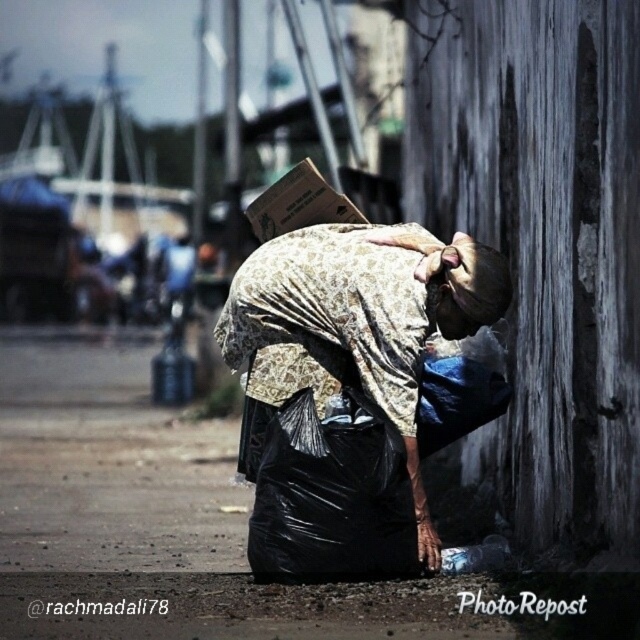
Question: Is printed fabric bag at lower center to the left of brown woven hat at center from the viewer's perspective?

Choices:
 (A) yes
 (B) no

Answer: (A)

Question: Estimate the real-world distances between objects in this image. Which object is closer to the brown woven hat at center?

Choices:
 (A) printed fabric bag at lower center
 (B) brown cardboard box at center

Answer: (A)

Question: Which point appears closest to the camera in this image?

Choices:
 (A) (300, 180)
 (B) (420, 244)
 (C) (236, 305)

Answer: (B)

Question: Does brown woven hat at center have a larger size compared to brown cardboard box at center?

Choices:
 (A) no
 (B) yes

Answer: (A)

Question: Is printed fabric bag at lower center further to camera compared to brown cardboard box at center?

Choices:
 (A) yes
 (B) no

Answer: (B)

Question: Which point appears farthest from the camera in this image?

Choices:
 (A) (275, 385)
 (B) (289, 173)
 (C) (424, 241)

Answer: (B)